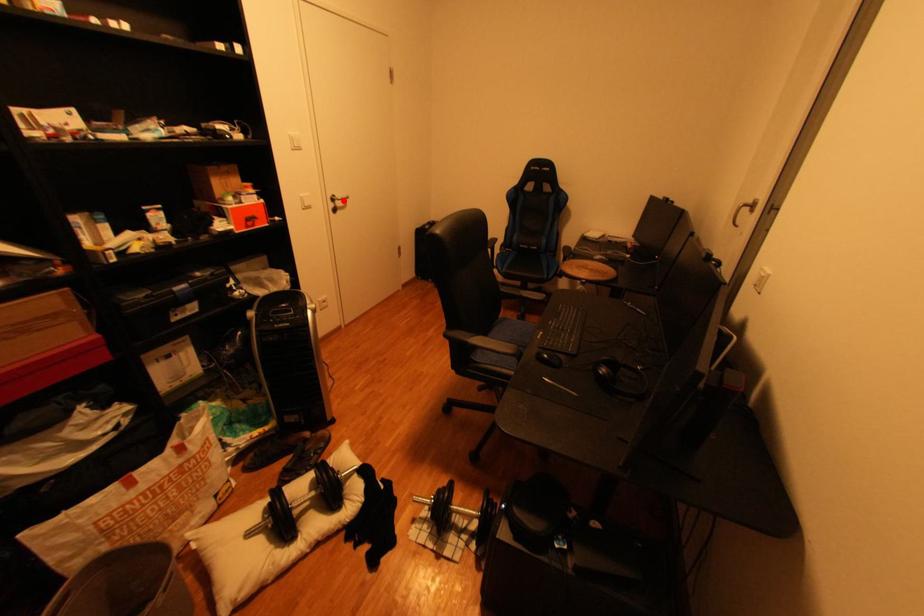
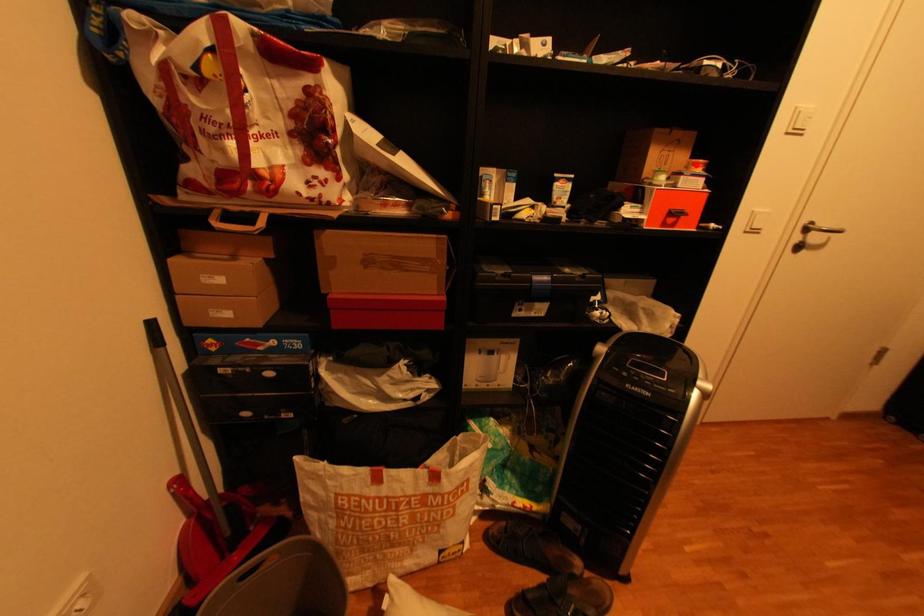
I am providing you with two images of the same scene from different viewpoints. A red point is marked on the first image and another point is marked on the second image. Do the highlighted points in image1 and image2 indicate the same real-world spot?

No